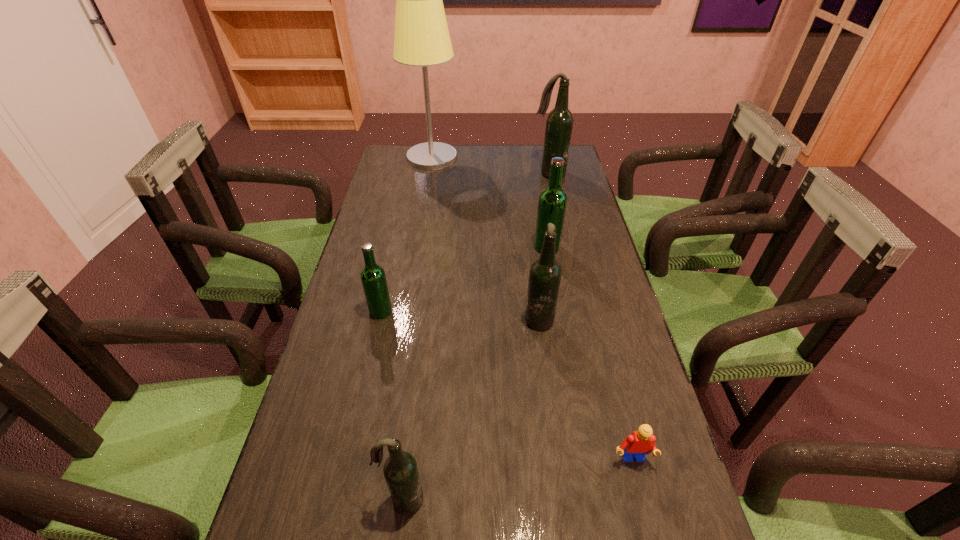
The width and height of the screenshot is (960, 540). In order to click on the closest dark beer bottle to the farthest dark beer bottle in this screenshot , I will do `click(545, 273)`.

I want to click on free point that satisfies the following two spatial constraints: 1. on the front side of the smallest dark beer bottle; 2. on the left side of the table lamp, so click(375, 500).